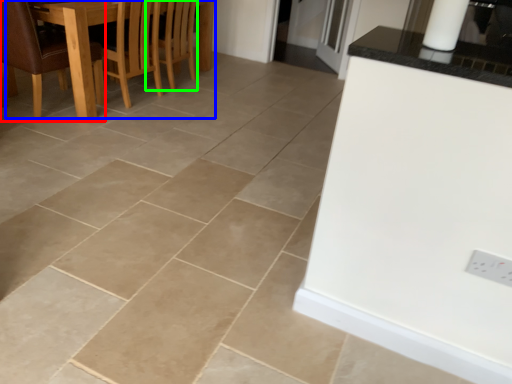
Question: Which object is positioned closest to chair (highlighted by a red box)? Select from kitchen & dining room table (highlighted by a blue box) and armchair (highlighted by a green box).

Choices:
 (A) kitchen & dining room table
 (B) armchair

Answer: (A)